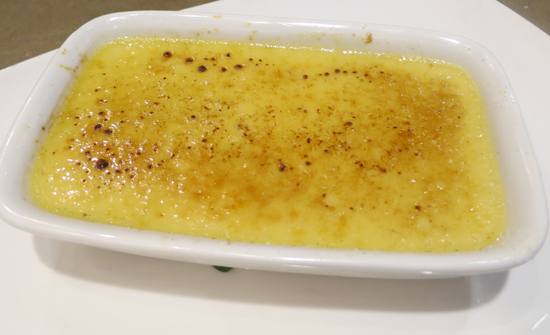
I want to click on white porcelain, so click(x=223, y=317).